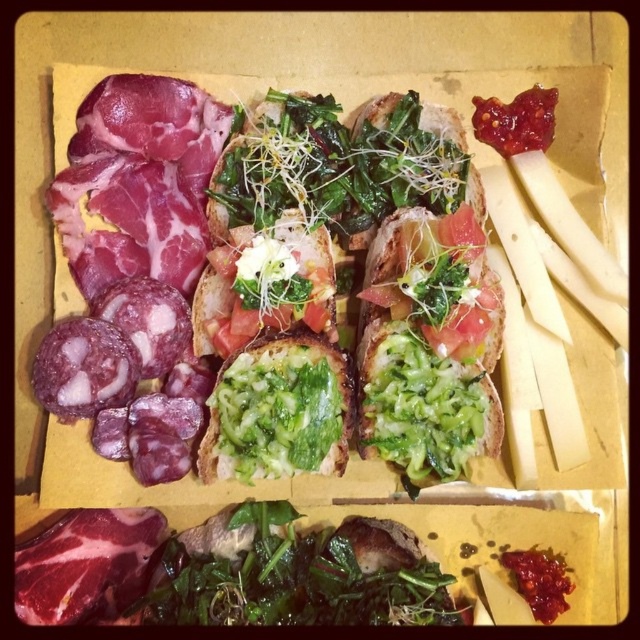
Question: Which of the following is the closest to the observer?

Choices:
 (A) (269, 451)
 (B) (420, 435)

Answer: (A)

Question: Can you confirm if green leafy vegetable at center is positioned to the right of green leafymaterial/texturevegetable at center?

Choices:
 (A) no
 (B) yes

Answer: (B)

Question: Which point is closer to the camera?

Choices:
 (A) (269, 435)
 (B) (362, 371)

Answer: (A)

Question: Is green leafy vegetable at center bigger than green leafymaterial/texturevegetable at center?

Choices:
 (A) yes
 (B) no

Answer: (A)

Question: Which object appears farthest from the camera in this image?

Choices:
 (A) green leafymaterial/texturevegetable at center
 (B) green leafy vegetable at center

Answer: (B)

Question: Where is green leafy vegetable at center located in relation to green leafymaterial/texturevegetable at center in the image?

Choices:
 (A) left
 (B) right

Answer: (B)